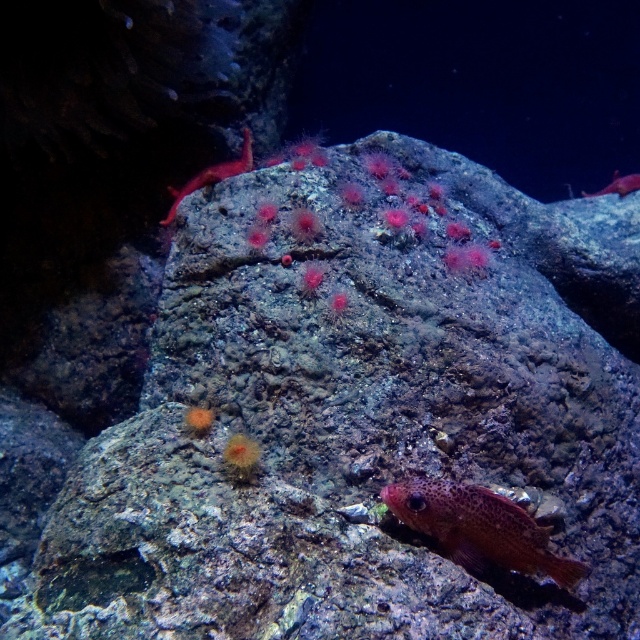
Is point (540, 572) farther from camera compared to point (582, 193)?

That is False.

Where is `spotted orange fish at lower right`? spotted orange fish at lower right is located at coordinates (477, 528).

Can you confirm if spotted orange fish at lower right is positioned below translucent pink coral at upper center?

Yes, spotted orange fish at lower right is below translucent pink coral at upper center.

Who is shorter, spotted orange fish at lower right or translucent pink coral at upper center?

Standing shorter between the two is spotted orange fish at lower right.

Does point (444, 540) come in front of point (244, 148)?

Yes, point (444, 540) is closer to viewer.

You are a GUI agent. You are given a task and a screenshot of the screen. Output one action in this format:
    pyautogui.click(x=<x>, y=<y>)
    Task: Click on the spotted orange fish at lower right
    This screenshot has width=640, height=640.
    Given the screenshot: What is the action you would take?
    pyautogui.click(x=477, y=528)

Is translucent pink coral at upper center above smooth red fish at upper right?

Incorrect, translucent pink coral at upper center is not positioned above smooth red fish at upper right.

Is translucent pink coral at upper center positioned before smooth red fish at upper right?

Yes, it is.

What do you see at coordinates (211, 176) in the screenshot? Image resolution: width=640 pixels, height=640 pixels. I see `translucent pink coral at upper center` at bounding box center [211, 176].

Locate an element on the screen. translucent pink coral at upper center is located at coordinates (211, 176).